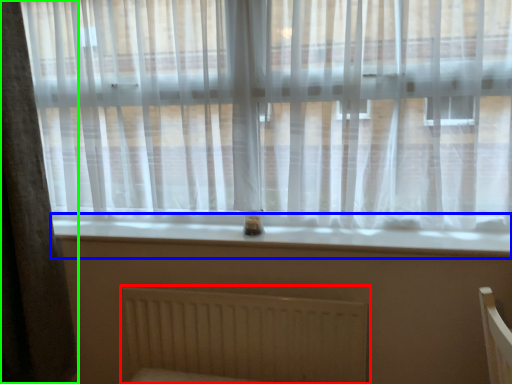
Question: Which is farther away from radiator (highlighted by a red box)? window sill (highlighted by a blue box) or curtain (highlighted by a green box)?

Choices:
 (A) window sill
 (B) curtain

Answer: (B)